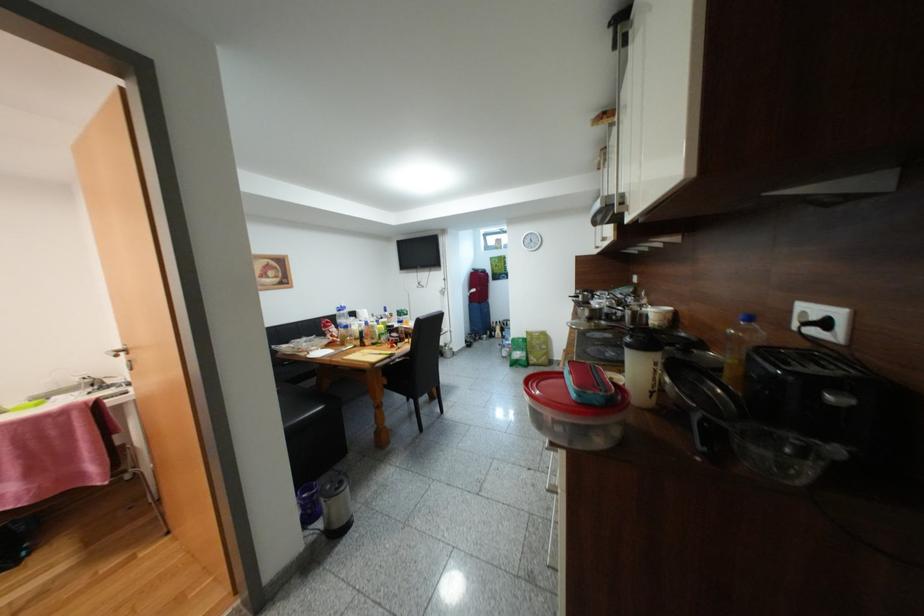
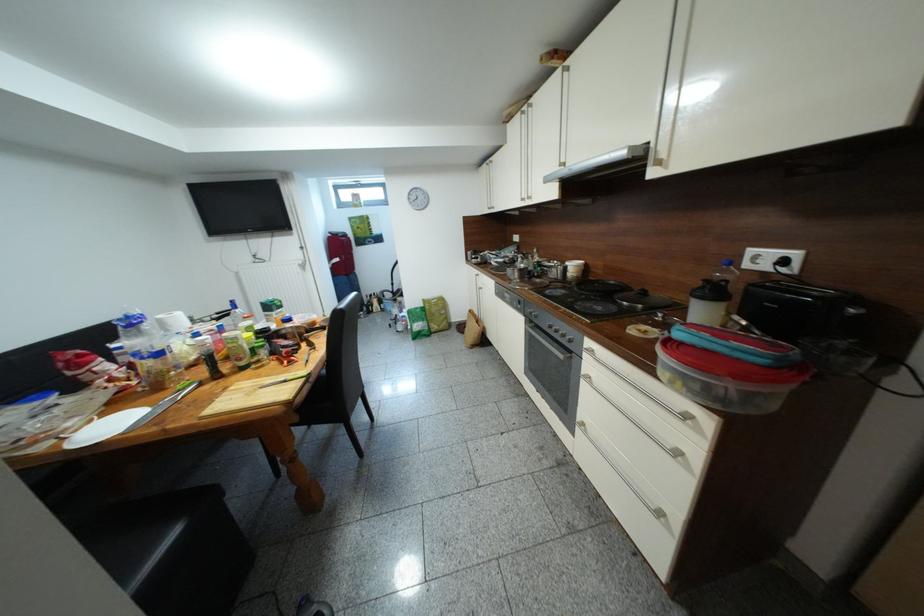
Question: How did the camera likely rotate?

Choices:
 (A) Left
 (B) Right
 (C) Up
 (D) Down

Answer: (B)